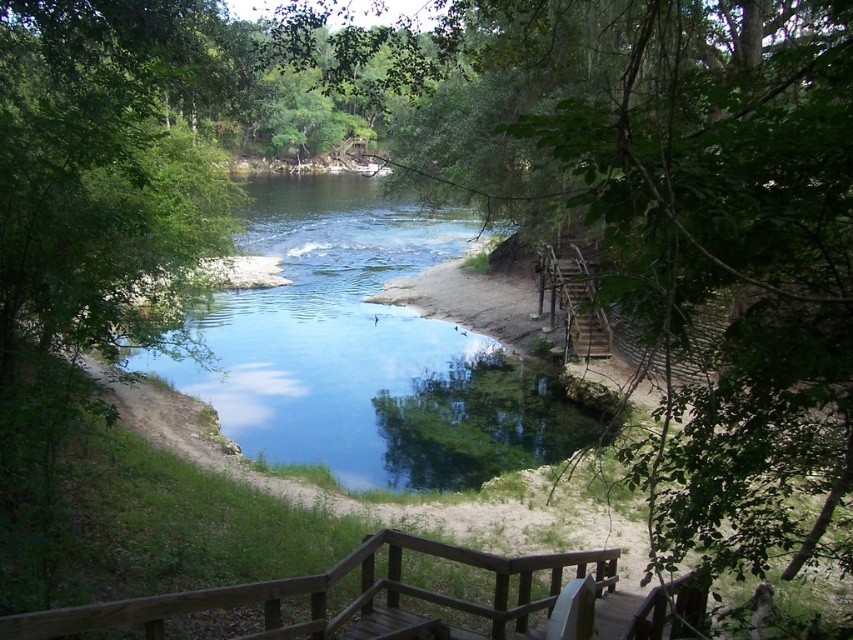
Question: Among these objects, which one is farthest from the camera?

Choices:
 (A) clear water at center
 (B) wooden stairs at right

Answer: (A)

Question: Is clear water at center in front of wooden stairs at right?

Choices:
 (A) no
 (B) yes

Answer: (A)

Question: Is clear water at center positioned in front of wooden stairs at right?

Choices:
 (A) yes
 (B) no

Answer: (B)

Question: Which point is farther to the camera?

Choices:
 (A) clear water at center
 (B) wooden stairs at right

Answer: (A)

Question: Which point appears closest to the camera in this image?

Choices:
 (A) (576, 330)
 (B) (270, 236)

Answer: (A)

Question: Can you confirm if clear water at center is wider than wooden stairs at right?

Choices:
 (A) no
 (B) yes

Answer: (B)